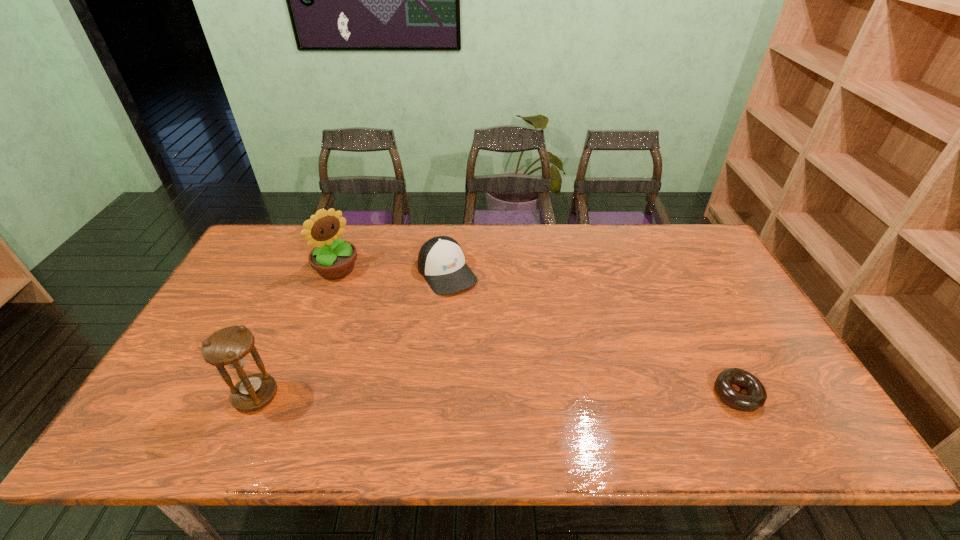
Locate an element on the screen. The width and height of the screenshot is (960, 540). free location located 0.210m on the face of the sunflower is located at coordinates 388,314.

The width and height of the screenshot is (960, 540). In order to click on vacant space located on the front panel of the cap in this screenshot , I will do `click(496, 340)`.

I want to click on vacant region located on the front panel of the cap, so click(502, 348).

Locate an element on the screen. free space located on the front panel of the cap is located at coordinates (473, 310).

Find the location of a particular element. This screenshot has width=960, height=540. sunflower located at the far edge is located at coordinates (332, 258).

Identify the location of cap at the far edge. (441, 261).

Where is `hourglass located at the near edge`? The width and height of the screenshot is (960, 540). hourglass located at the near edge is located at coordinates (229, 347).

I want to click on doughnut present at the near edge, so click(x=756, y=396).

Identify the location of object that is at the right edge. (756, 396).

I want to click on object present at the near right corner, so click(x=756, y=396).